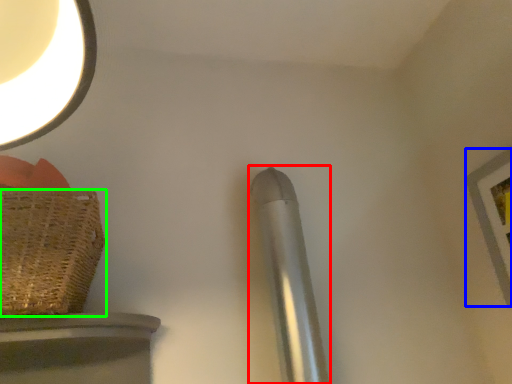
Question: Which is nearer to the steel (highlighted by a red box)? picture frame (highlighted by a blue box) or basket (highlighted by a green box).

Choices:
 (A) picture frame
 (B) basket

Answer: (B)